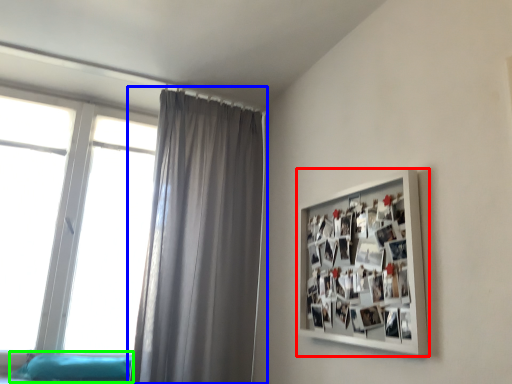
Question: Which object is positioned closest to picture frame (highlighted by a red box)? Select from curtain (highlighted by a blue box) and bed frame (highlighted by a green box).

Choices:
 (A) curtain
 (B) bed frame

Answer: (A)